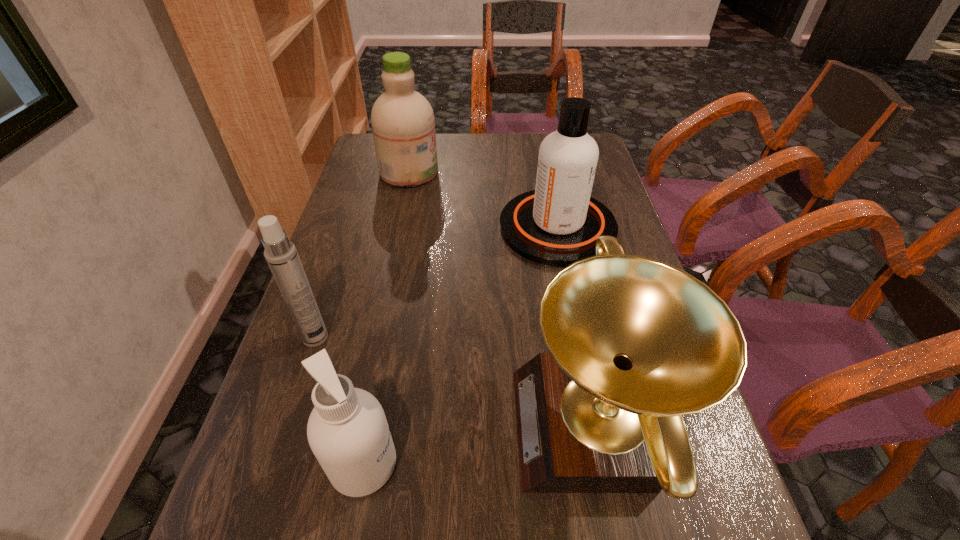
This screenshot has width=960, height=540. I want to click on the farthest cleansing agent, so click(x=403, y=125).

Identify the location of the rightmost cleansing agent. The width and height of the screenshot is (960, 540). (558, 223).

You are a GUI agent. You are given a task and a screenshot of the screen. Output one action in this format:
    pyautogui.click(x=<x>, y=<y>)
    Task: Click on the fourth nearest object
    This screenshot has width=960, height=540.
    Given the screenshot: What is the action you would take?
    pyautogui.click(x=558, y=223)

Where is `the leftmost object`? the leftmost object is located at coordinates (280, 253).

The width and height of the screenshot is (960, 540). Find the location of `the shortest cleansing agent`. the shortest cleansing agent is located at coordinates (347, 430).

The height and width of the screenshot is (540, 960). I want to click on free space located 0.370m on the front label of the farthest cleansing agent, so click(557, 172).

I want to click on free point located 0.110m on the left of the second farthest cleansing agent, so click(459, 227).

This screenshot has height=540, width=960. I want to click on free space located on the right of the leftmost object, so click(x=428, y=338).

Find the location of a particular element. free spot located 0.360m on the front label of the shortest cleansing agent is located at coordinates (612, 464).

Where is `object that is positioned at the far edge`? The width and height of the screenshot is (960, 540). object that is positioned at the far edge is located at coordinates (403, 125).